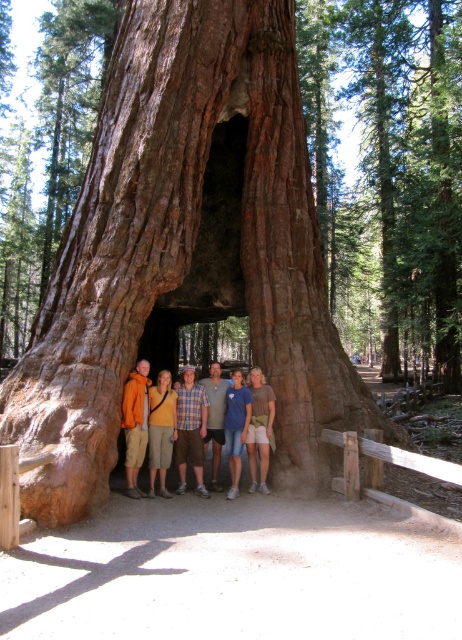
The image size is (462, 640). What are the coordinates of `brown rough tree trunk at center` in the screenshot? It's located at (187, 250).

Is point (256, 148) farther from viewer compared to point (266, 385)?

That is True.

Describe the element at coordinates (187, 250) in the screenshot. I see `brown rough tree trunk at center` at that location.

The image size is (462, 640). Find the location of `brown rough tree trunk at center`. brown rough tree trunk at center is located at coordinates (187, 250).

Can you confirm if brown rough tree trunk at center is positioned above gray cotton shirt at center?

Yes.

Consider the image. Who is taller, brown rough tree trunk at center or gray cotton shirt at center?

gray cotton shirt at center

You are a GUI agent. You are given a task and a screenshot of the screen. Output one action in this format:
    pyautogui.click(x=<x>, y=<y>)
    Task: Click on the brown rough tree trunk at center
    
    Given the screenshot: What is the action you would take?
    pyautogui.click(x=187, y=250)

At what (x,y) coordinates should I click in order to perform the action: click on brown rough tree trunk at center. Please return your answer as a coordinate pair (x, y). Image resolution: width=462 pixels, height=640 pixels. Looking at the image, I should click on (187, 250).

Can you confirm if plaid shirt at center is taller than gray cotton shirt at center?

Yes, plaid shirt at center is taller than gray cotton shirt at center.

You are a GUI agent. You are given a task and a screenshot of the screen. Output one action in this format:
    pyautogui.click(x=<x>, y=<y>)
    Task: Click on the plaid shirt at center
    This screenshot has height=640, width=462.
    Given the screenshot: What is the action you would take?
    pyautogui.click(x=190, y=429)

Locate an element on the screen. This screenshot has height=640, width=462. plaid shirt at center is located at coordinates (190, 429).